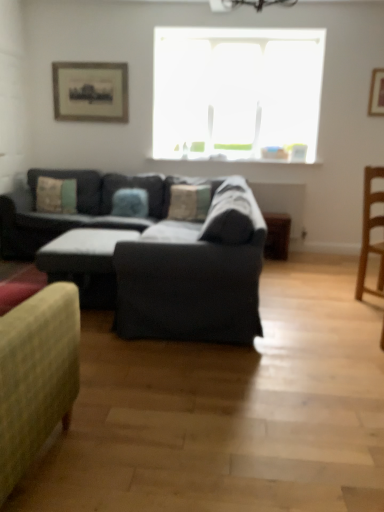
Question: From the image's perspective, is light brown wooden chair at right located above dark gray fabric couch at center?

Choices:
 (A) yes
 (B) no

Answer: (A)

Question: Is light brown wooden chair at right to the left of dark gray fabric couch at center from the viewer's perspective?

Choices:
 (A) no
 (B) yes

Answer: (A)

Question: Are light brown wooden chair at right and dark gray fabric couch at center located far from each other?

Choices:
 (A) no
 (B) yes

Answer: (B)

Question: From the image's perspective, is light brown wooden chair at right below dark gray fabric couch at center?

Choices:
 (A) yes
 (B) no

Answer: (B)

Question: From a real-world perspective, is light brown wooden chair at right below dark gray fabric couch at center?

Choices:
 (A) no
 (B) yes

Answer: (A)

Question: In terms of height, does blue fabric pillow at center, which is the 2th pillow in left-to-right order, look taller or shorter compared to wooden side table at lower right?

Choices:
 (A) tall
 (B) short

Answer: (B)

Question: Considering the positions of point click(x=114, y=192) and point click(x=281, y=214), is point click(x=114, y=192) closer or farther from the camera than point click(x=281, y=214)?

Choices:
 (A) closer
 (B) farther

Answer: (A)

Question: Is blue fabric pillow at center, which appears as the 2th pillow when viewed from the right, spatially inside wooden side table at lower right, or outside of it?

Choices:
 (A) outside
 (B) inside

Answer: (A)

Question: From the image's perspective, is blue fabric pillow at center, which appears as the 2th pillow when viewed from the right, located above or below wooden side table at lower right?

Choices:
 (A) below
 (B) above

Answer: (B)

Question: From the image's perspective, is wooden picture frame at upper right, positioned as the 2th picture frame in back-to-front order, positioned above or below light brown wooden chair at right?

Choices:
 (A) above
 (B) below

Answer: (A)

Question: Is wooden picture frame at upper right, positioned as the 2th picture frame in back-to-front order, wider or thinner than light brown wooden chair at right?

Choices:
 (A) wide
 (B) thin

Answer: (B)

Question: Visually, is wooden picture frame at upper right, positioned as the 2th picture frame in back-to-front order, positioned to the left or to the right of light brown wooden chair at right?

Choices:
 (A) left
 (B) right

Answer: (B)

Question: Considering the positions of wooden picture frame at upper right, marked as the first picture frame in a right-to-left arrangement, and light brown wooden chair at right in the image, is wooden picture frame at upper right, marked as the first picture frame in a right-to-left arrangement, taller or shorter than light brown wooden chair at right?

Choices:
 (A) tall
 (B) short

Answer: (B)

Question: Relative to textured beige pillow at left, which is counted as the 3th pillow, starting from the right, is light brown wooden chair at right in front or behind?

Choices:
 (A) behind
 (B) front

Answer: (B)

Question: Is light brown wooden chair at right to the left or to the right of textured beige pillow at left, which is counted as the 3th pillow, starting from the right, in the image?

Choices:
 (A) left
 (B) right

Answer: (B)